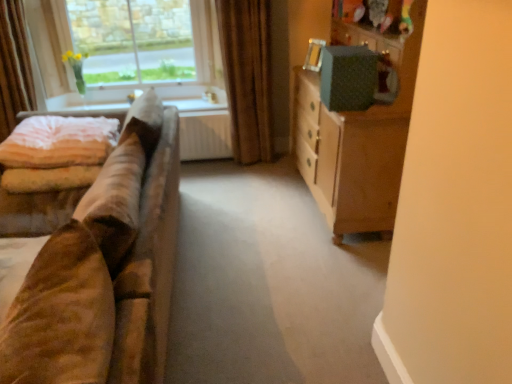
Question: Is suede brown couch at left closer to camera compared to velvet curtain at left, the second curtain from the right?

Choices:
 (A) no
 (B) yes

Answer: (B)

Question: Can you confirm if suede brown couch at left is shorter than velvet curtain at left, the second curtain from the right?

Choices:
 (A) yes
 (B) no

Answer: (A)

Question: Is velvet curtain at left, the second curtain from the right, inside suede brown couch at left?

Choices:
 (A) no
 (B) yes

Answer: (A)

Question: From the image's perspective, is suede brown couch at left above velvet curtain at left, the second curtain from the right?

Choices:
 (A) no
 (B) yes

Answer: (A)

Question: Can you see suede brown couch at left touching velvet curtain at left, the second curtain from the right?

Choices:
 (A) yes
 (B) no

Answer: (B)

Question: Are suede brown couch at left and velvet curtain at left, positioned as the first curtain in left-to-right order, far apart?

Choices:
 (A) no
 (B) yes

Answer: (B)

Question: Does velvet curtain at left, positioned as the first curtain in left-to-right order, have a smaller size compared to white fabric at upper left?

Choices:
 (A) no
 (B) yes

Answer: (A)

Question: Is velvet curtain at left, the second curtain from the right, closer to the viewer compared to white fabric at upper left?

Choices:
 (A) yes
 (B) no

Answer: (A)

Question: Is velvet curtain at left, positioned as the first curtain in left-to-right order, facing towards white fabric at upper left?

Choices:
 (A) yes
 (B) no

Answer: (B)

Question: Can you confirm if velvet curtain at left, positioned as the first curtain in left-to-right order, is bigger than white fabric at upper left?

Choices:
 (A) no
 (B) yes

Answer: (B)

Question: Can you confirm if velvet curtain at left, the second curtain from the right, is wider than white fabric at upper left?

Choices:
 (A) yes
 (B) no

Answer: (B)

Question: From the image's perspective, does velvet curtain at left, the second curtain from the right, appear higher than white fabric at upper left?

Choices:
 (A) yes
 (B) no

Answer: (A)

Question: From the image's perspective, is light pink velvety quilt at left located above clear glass window at upper left?

Choices:
 (A) yes
 (B) no

Answer: (B)